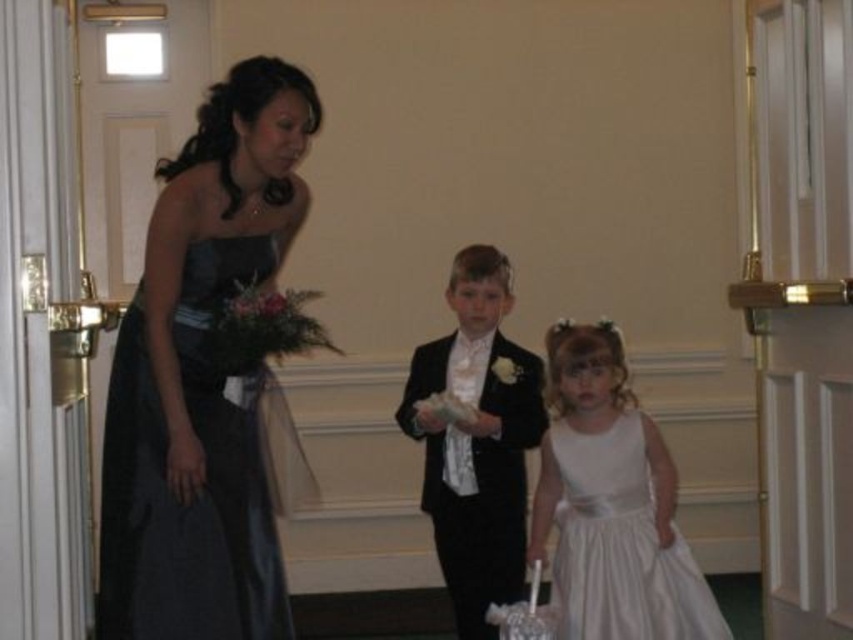
You are attending a formal event and need to locate the shiny dark blue dress at left. According to the coordinates provided, where exactly is it positioned in the image?

The shiny dark blue dress at left is located at coordinates point (202, 378).